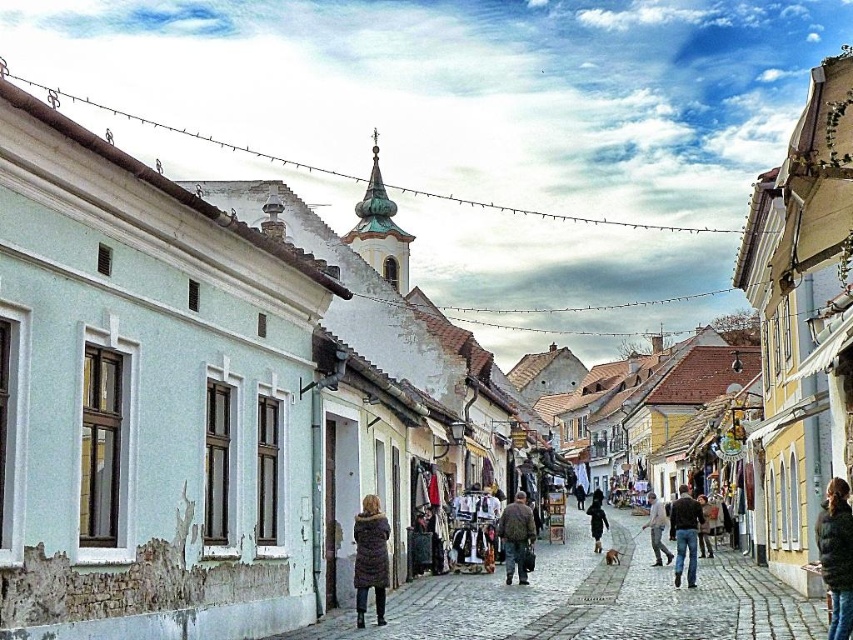
Can you confirm if jeans at center is thinner than brown fuzzy coat at center?

Incorrect, jeans at center's width is not less than brown fuzzy coat at center's.

Is jeans at center taller than brown fuzzy coat at center?

Yes, jeans at center is taller than brown fuzzy coat at center.

Which is in front, point (677, 579) or point (706, 529)?

Point (677, 579) is in front.

Identify the location of jeans at center. (685, 534).

Which is behind, point (842, 609) or point (701, 528)?

The point (701, 528) is behind.

Is black fuzzy jacket at lower right further to the viewer compared to brown fuzzy coat at center?

No, it is in front of brown fuzzy coat at center.

Between point (824, 524) and point (703, 522), which one is positioned behind?

Positioned behind is point (703, 522).

The width and height of the screenshot is (853, 640). Identify the location of black fuzzy jacket at lower right. (836, 556).

What do you see at coordinates (515, 536) in the screenshot? I see `camouflage jacket at center` at bounding box center [515, 536].

Is camouflage jacket at center thinner than jeans at center?

Indeed, camouflage jacket at center has a lesser width compared to jeans at center.

Does point (527, 545) come closer to viewer compared to point (683, 525)?

No, (527, 545) is further to viewer.

You are a GUI agent. You are given a task and a screenshot of the screen. Output one action in this format:
    pyautogui.click(x=<x>, y=<y>)
    Task: Click on the camouflage jacket at center
    This screenshot has width=853, height=640.
    Given the screenshot: What is the action you would take?
    pyautogui.click(x=515, y=536)